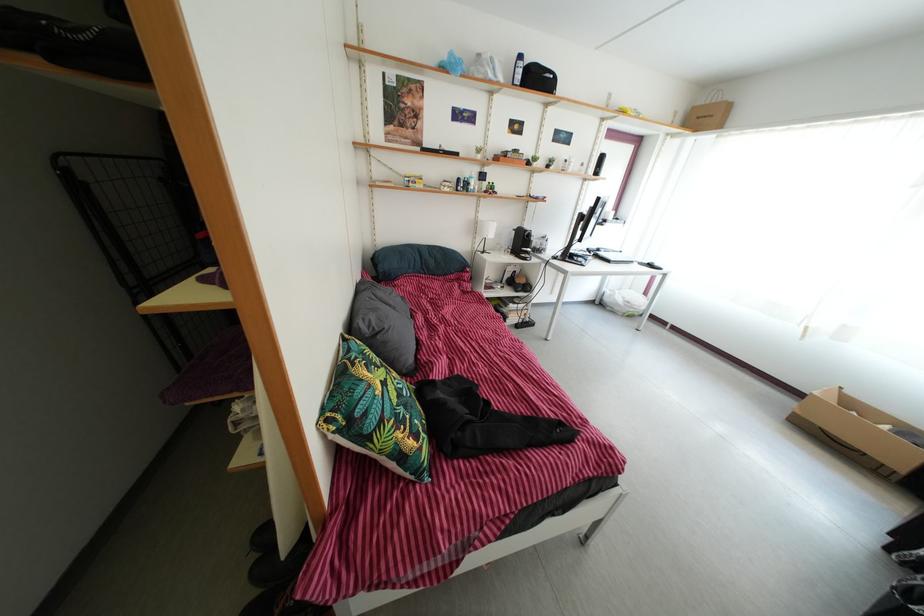
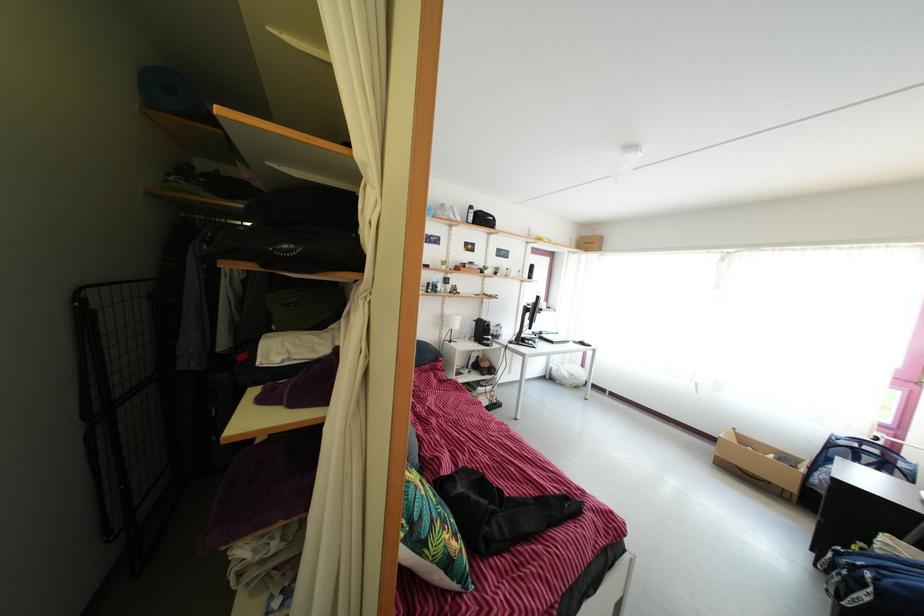
Locate, in the second image, the point that corresponds to the point at 387,429 in the first image.

(439, 531)